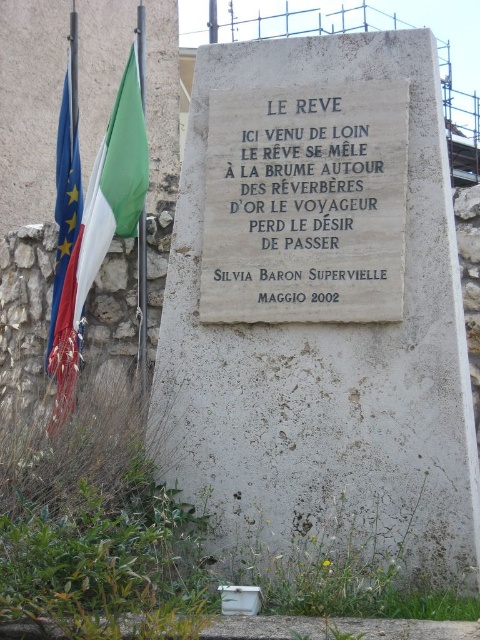
Question: Which point is closer to the camera?

Choices:
 (A) (103, 259)
 (B) (61, 150)
 (C) (280, 186)

Answer: (C)

Question: Is green fabric flag at left to the right of european union flag at left from the viewer's perspective?

Choices:
 (A) yes
 (B) no

Answer: (A)

Question: Which of the following is the closest to the observer?

Choices:
 (A) black stone plaque at center
 (B) green fabric flag at left
 (C) european union flag at left

Answer: (A)

Question: Which point is closer to the camera?

Choices:
 (A) european union flag at left
 (B) green fabric flag at left

Answer: (B)

Question: Can you confirm if black stone plaque at center is bigger than european union flag at left?

Choices:
 (A) no
 (B) yes

Answer: (A)

Question: Does green fabric flag at left have a greater width compared to european union flag at left?

Choices:
 (A) no
 (B) yes

Answer: (A)